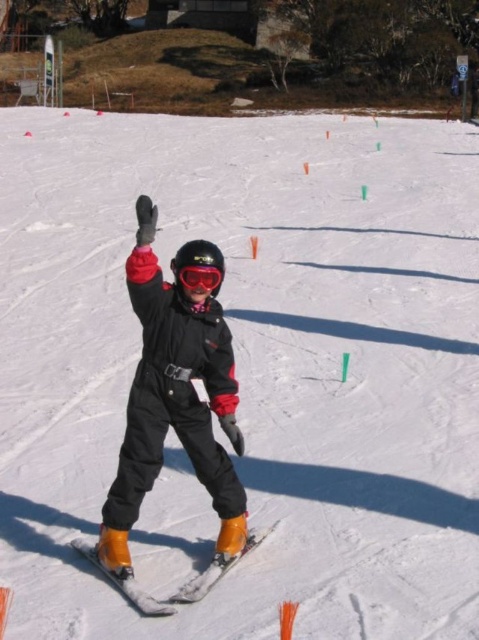
Question: Which of the following is the closest to the observer?

Choices:
 (A) (189, 292)
 (B) (181, 284)
 (C) (101, 564)

Answer: (A)

Question: Which is nearer to the orange matte ski at center?

Choices:
 (A) matte black snowsuit at center
 (B) matte black goggles at center

Answer: (A)

Question: Where is matte black snowsuit at center located in relation to matte black goggles at center in the image?

Choices:
 (A) above
 (B) below

Answer: (B)

Question: Does matte black snowsuit at center have a larger size compared to matte black goggles at center?

Choices:
 (A) no
 (B) yes

Answer: (B)

Question: Which point is closer to the camera?

Choices:
 (A) (228, 556)
 (B) (214, 278)
 (C) (148, 262)

Answer: (B)

Question: Observing the image, what is the correct spatial positioning of matte black snowsuit at center in reference to orange matte ski at center?

Choices:
 (A) above
 (B) below

Answer: (A)